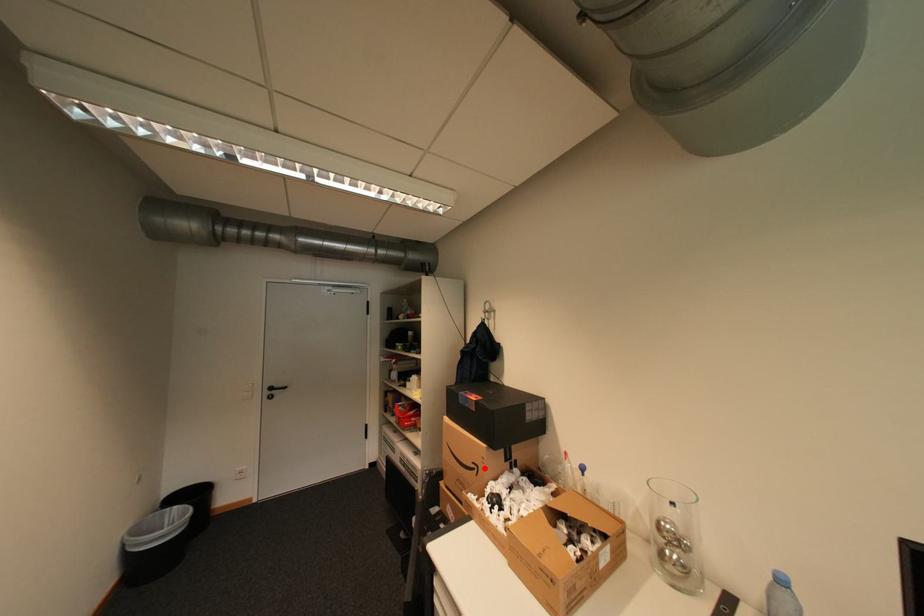
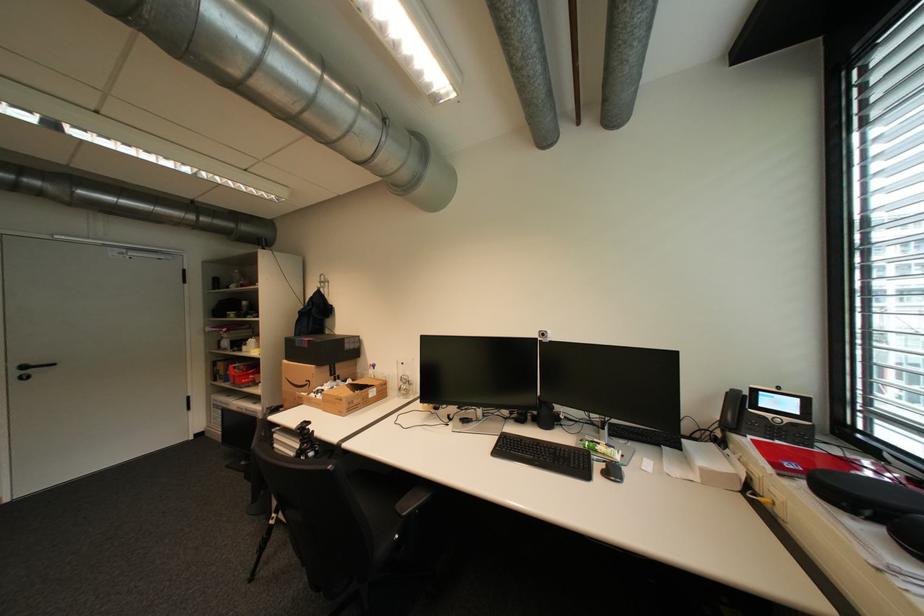
Question: A red point is marked in image1. In image2, is the corresponding 3D point closer to the camera or farther? Reply with the corresponding letter.

Choices:
 (A) The corresponding 3D point is closer.
 (B) The corresponding 3D point is farther.

Answer: (A)